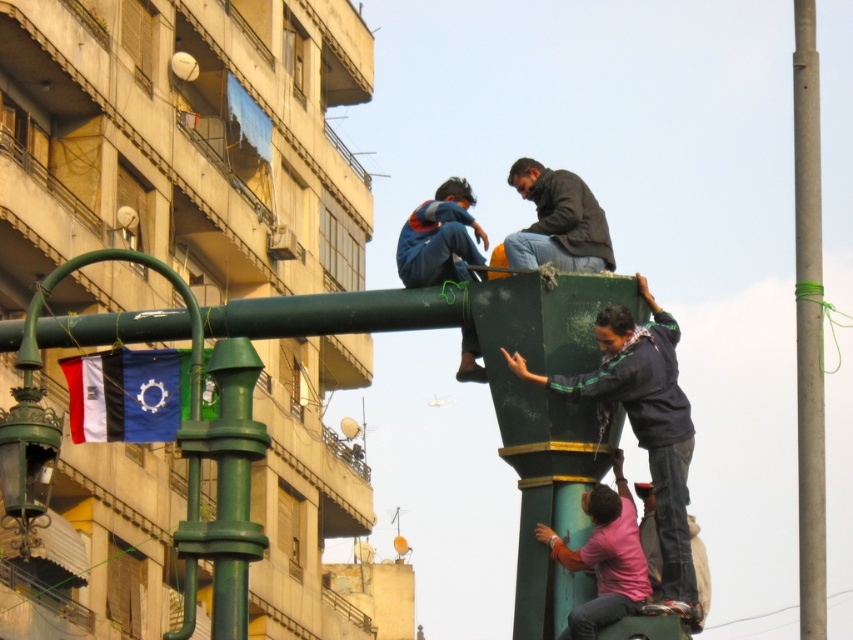
Is green painted metal pole at left positioned at the back of pink matte shirt at lower center?

No, green painted metal pole at left is in front of pink matte shirt at lower center.

Is point (44, 413) positioned before point (585, 566)?

Yes, it is.

Is point (12, 438) less distant than point (553, 538)?

Yes, point (12, 438) is closer to viewer.

Where is `green painted metal pole at left`? This screenshot has width=853, height=640. green painted metal pole at left is located at coordinates (41, 390).

In the scene shown: Does pink matte shirt at lower center lie in front of dark brown leather jacket at upper center?

Yes, pink matte shirt at lower center is in front of dark brown leather jacket at upper center.

Looking at this image, which is more to the left, pink matte shirt at lower center or dark brown leather jacket at upper center?

dark brown leather jacket at upper center is more to the left.

Who is more forward, (x=624, y=579) or (x=556, y=209)?

Point (x=624, y=579)

The width and height of the screenshot is (853, 640). In order to click on pink matte shirt at lower center in this screenshot , I will do `click(604, 556)`.

Does smooth green pole at right have a smaller size compared to green painted metal pole at left?

Incorrect, smooth green pole at right is not smaller in size than green painted metal pole at left.

Which is more to the left, smooth green pole at right or green painted metal pole at left?

Answer: Positioned to the left is green painted metal pole at left.

Does point (821, 616) come in front of point (183, 289)?

No, it is not.

Where is `smooth green pole at right`? The width and height of the screenshot is (853, 640). smooth green pole at right is located at coordinates (808, 326).